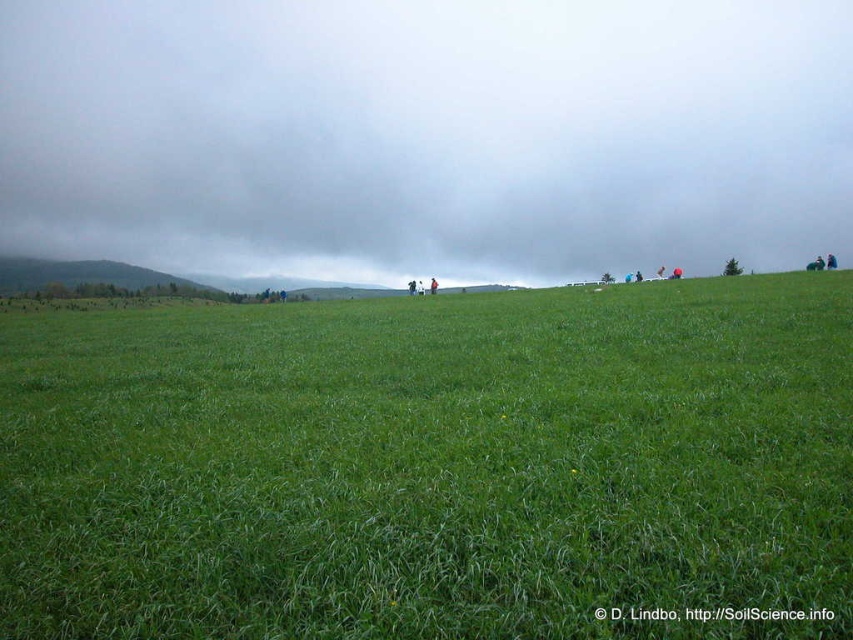
Who is positioned more to the left, green grassy field at center or gray cloudy sky at upper center?

From the viewer's perspective, gray cloudy sky at upper center appears more on the left side.

Is green grassy field at center below gray cloudy sky at upper center?

Correct, green grassy field at center is located below gray cloudy sky at upper center.

Between point (233, 346) and point (490, 131), which one is positioned in front?

Point (233, 346)

This screenshot has width=853, height=640. I want to click on green grassy field at center, so click(431, 465).